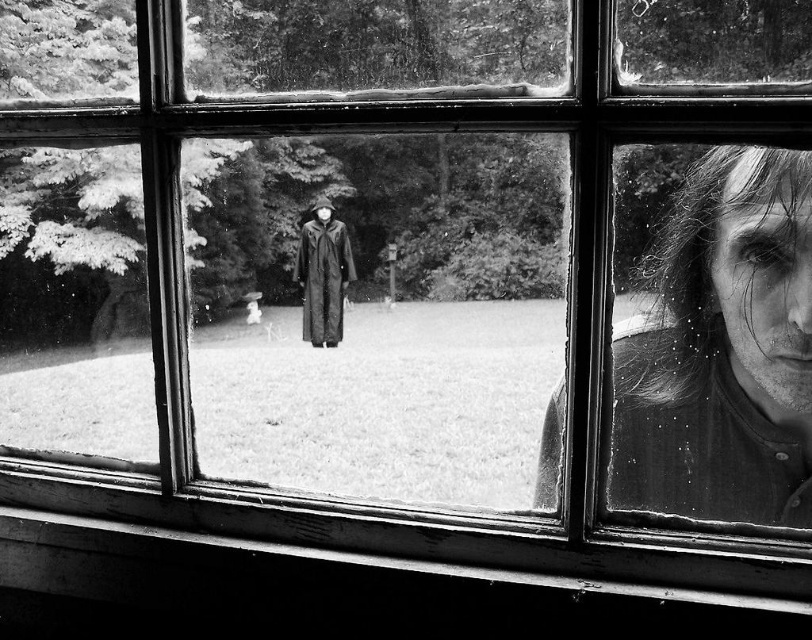
Who is shorter, smooth skin face at right or matte black robe at center?

matte black robe at center

Can you confirm if smooth skin face at right is positioned to the right of matte black robe at center?

Indeed, smooth skin face at right is positioned on the right side of matte black robe at center.

Who is more distant from viewer, (670, 371) or (344, 241)?

Positioned behind is point (344, 241).

The image size is (812, 640). What are the coordinates of `smooth skin face at right` in the screenshot? It's located at (722, 349).